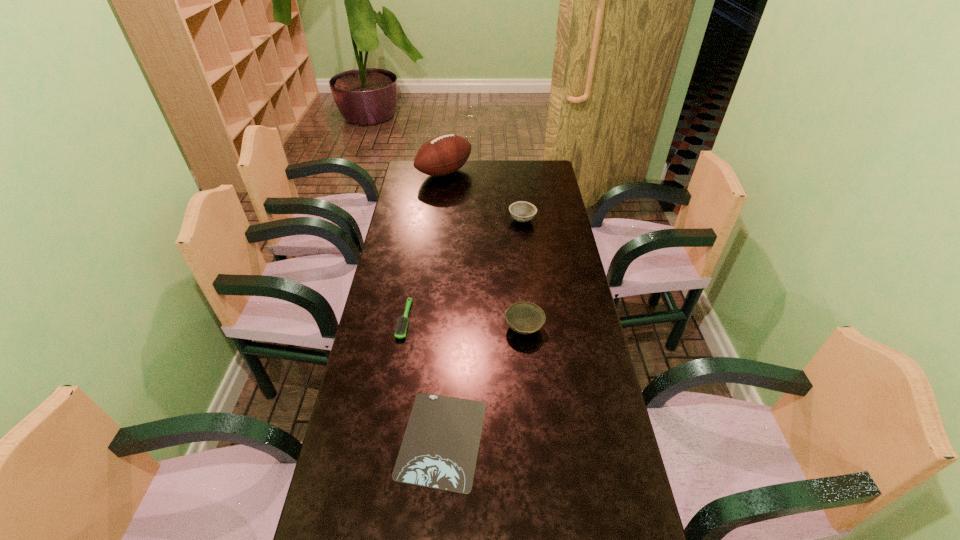
Locate which object is the second closest to the tallest object. Please provide its 2D coordinates. Your answer should be formatted as a tuple, i.e. [(x, y)], where the tuple contains the x and y coordinates of a point satisfying the conditions above.

[(400, 331)]

Select which object is the second closest to the nearer bowl. Please provide its 2D coordinates. Your answer should be formatted as a tuple, i.e. [(x, y)], where the tuple contains the x and y coordinates of a point satisfying the conditions above.

[(400, 331)]

Where is `vacant space that satisfies the following two spatial constraints: 1. on the back side of the second shortest object; 2. on the right side of the farther bowl`? vacant space that satisfies the following two spatial constraints: 1. on the back side of the second shortest object; 2. on the right side of the farther bowl is located at coordinates (420, 220).

You are a GUI agent. You are given a task and a screenshot of the screen. Output one action in this format:
    pyautogui.click(x=<x>, y=<y>)
    Task: Click on the free space that satisfies the following two spatial constraints: 1. on the back side of the nearest object; 2. on the right side of the nearer bowl
    The width and height of the screenshot is (960, 540).
    Given the screenshot: What is the action you would take?
    pyautogui.click(x=449, y=328)